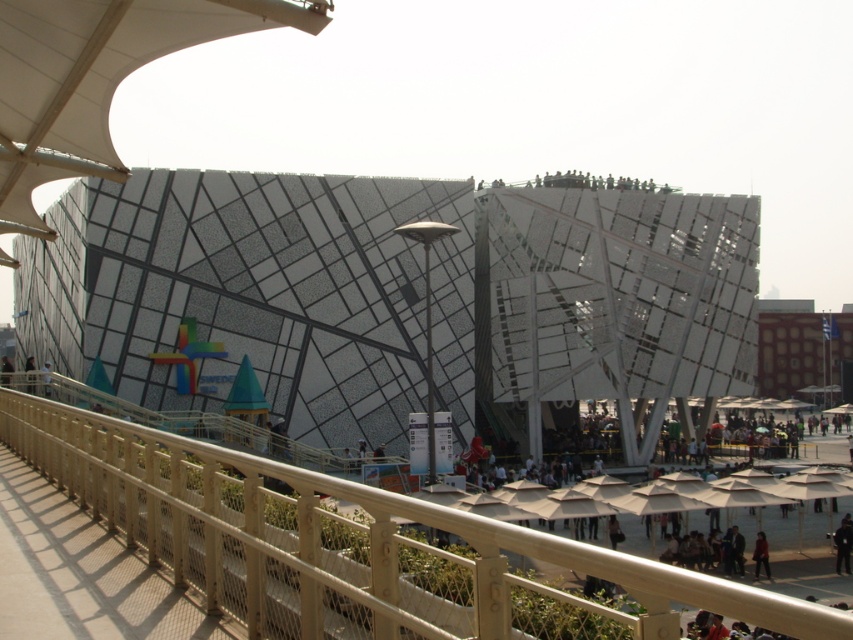
Measure the distance between white fabric canopy at upper left and camera.

31.18 meters

Does white fabric canopy at upper left appear on the right side of dark brown leather jacket at upper left?

Yes, white fabric canopy at upper left is to the right of dark brown leather jacket at upper left.

Measure the distance between point [6,198] and camera.

Point [6,198] is 56.38 meters from camera.

Identify the location of white fabric canopy at upper left. (96, 77).

Can you confirm if dark red fabric at lower right is positioned above white fabric umbrella at center?

No.

Between dark red fabric at lower right and white fabric umbrella at center, which one is positioned lower?

dark red fabric at lower right

The image size is (853, 640). Identify the location of dark red fabric at lower right. (759, 556).

Which is behind, point (415, 624) or point (756, 541)?

Point (756, 541)

This screenshot has height=640, width=853. I want to click on wooden at center, so [351, 545].